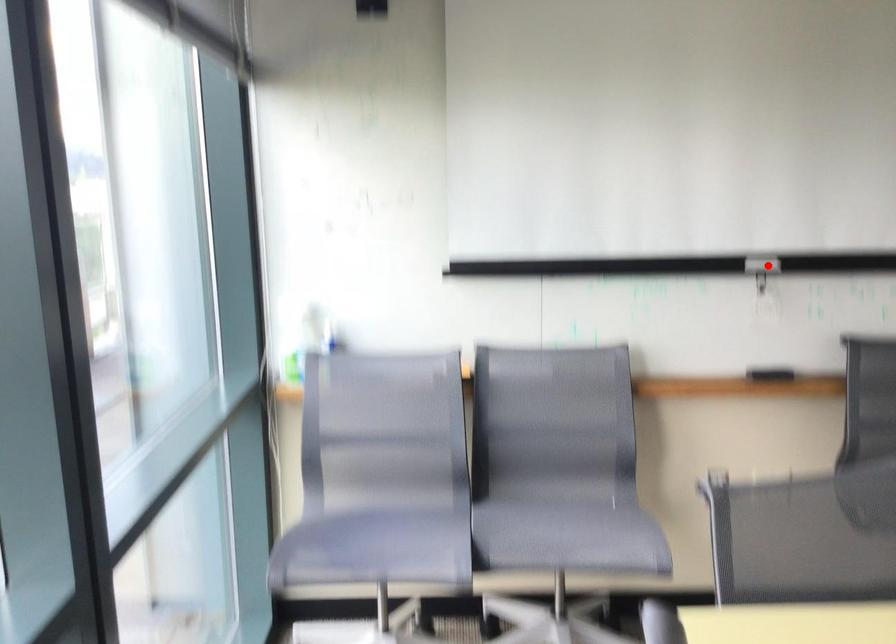
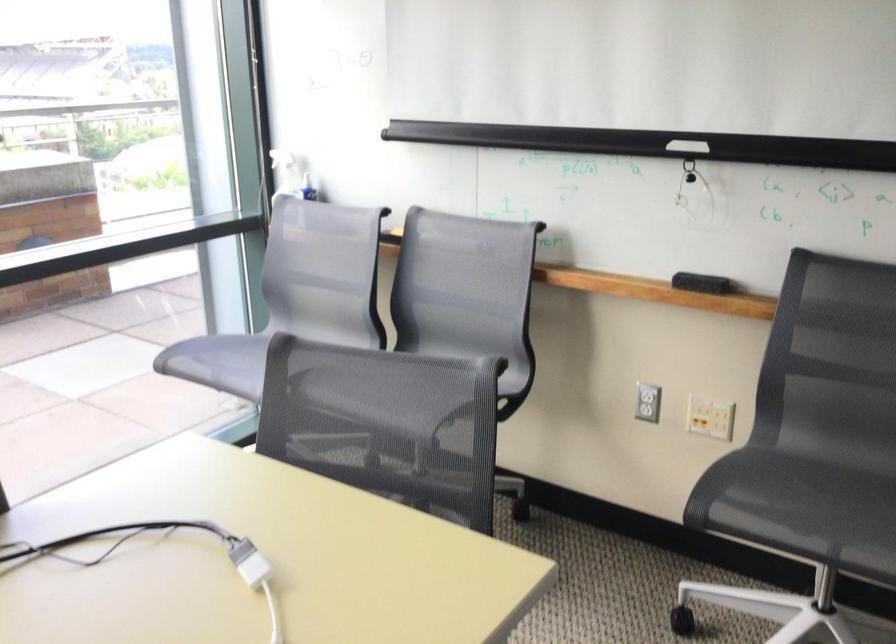
Locate, in the second image, the point that corresponds to the highlighted location in the first image.

(687, 146)